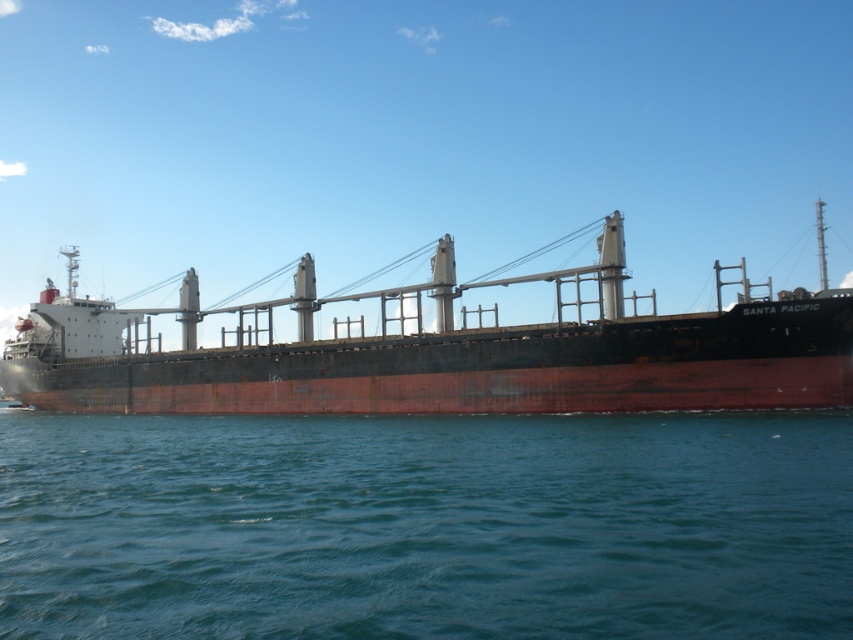
You are a photographer trying to capture the rusty metal ship at center and the blue water at lower center in a single frame. Which of the two objects will appear smaller in your photo?

The blue water at lower center will appear smaller in the photo because it is described as smaller than the rusty metal ship at center.

You are standing on the deck of the Santa Pacific cargo ship and looking out at the scene. There is a point marked at coordinates (426, 525). What is located at that point?

The blue water at lower center is located at the point marked by coordinates (426, 525).